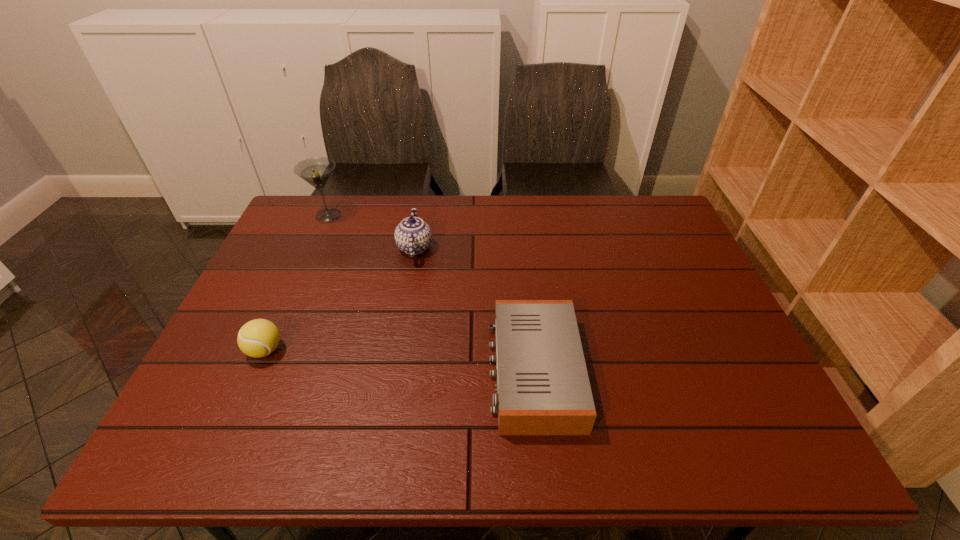
This screenshot has width=960, height=540. I want to click on martini, so click(316, 171).

The height and width of the screenshot is (540, 960). I want to click on the tallest object, so click(316, 171).

Locate an element on the screen. the second tallest object is located at coordinates [413, 236].

I want to click on the third nearest object, so click(413, 236).

You are a GUI agent. You are given a task and a screenshot of the screen. Output one action in this format:
    pyautogui.click(x=<x>, y=<y>)
    Task: Click on the tennis ball
    The height and width of the screenshot is (540, 960).
    Given the screenshot: What is the action you would take?
    pyautogui.click(x=257, y=338)

Locate an element on the screen. The height and width of the screenshot is (540, 960). the shortest object is located at coordinates (543, 388).

You are a GUI agent. You are given a task and a screenshot of the screen. Output one action in this format:
    pyautogui.click(x=<x>, y=<y>)
    Task: Click on the rightmost object
    This screenshot has height=540, width=960.
    Given the screenshot: What is the action you would take?
    pyautogui.click(x=543, y=388)

I want to click on blank space located on the right of the tallest object, so click(416, 215).

This screenshot has height=540, width=960. In order to click on free space located 0.230m at the spout of the chinaware in this screenshot , I will do `click(509, 248)`.

The image size is (960, 540). In order to click on vacant region located 0.240m on the right of the second shortest object in this screenshot , I will do `click(384, 350)`.